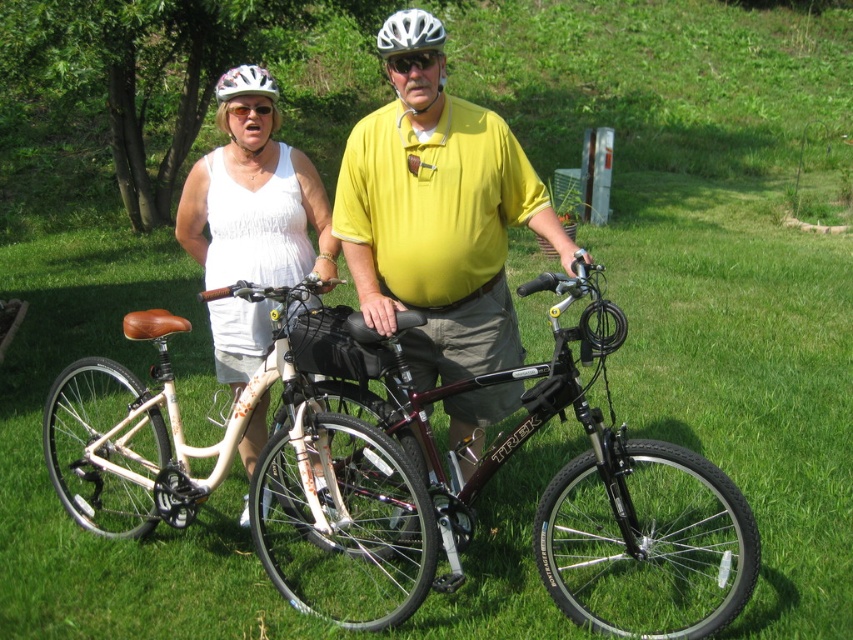
You are a photographer trying to capture a clear photo of the maroon matte bicycle at center and the white matte helmet at upper center. However, you notice that one object is blocking the view of the other. Which object is blocking the other?

The maroon matte bicycle at center is blocking the view of the white matte helmet at upper center because it is positioned in front of it.

You are a photographer trying to capture a clear photo of both the white matte helmet at center and the white matte helmet at upper center. Which helmet should you focus on first to ensure it appears larger in the photo?

The white matte helmet at center should be focused on first because it is much taller than the white matte helmet at upper center, making it appear larger in the photo.